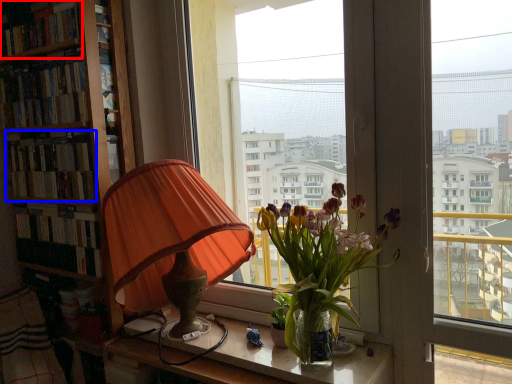
Question: Which point is closer to the camera, book (highlighted by a red box) or book (highlighted by a blue box)?

Choices:
 (A) book
 (B) book

Answer: (A)